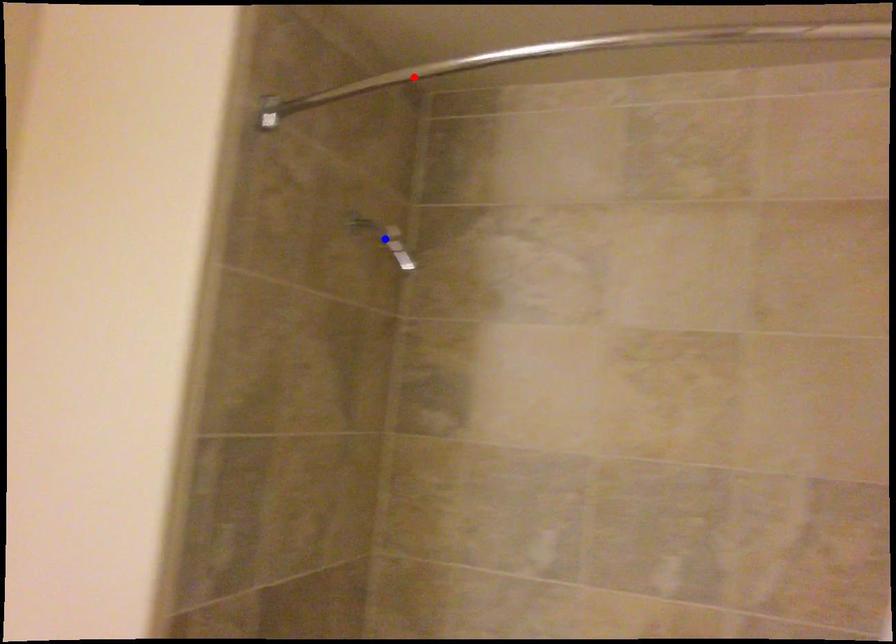
Question: Two points are marked on the image. Which point is closer to the camera?

Choices:
 (A) Blue point is closer.
 (B) Red point is closer.

Answer: (B)